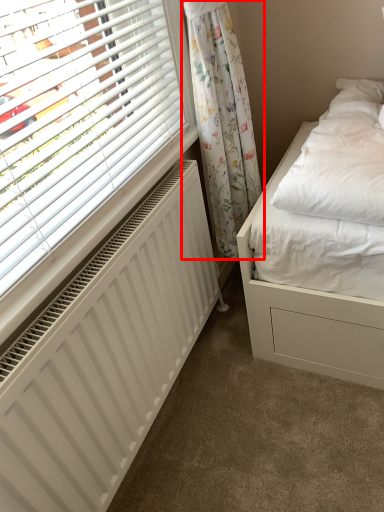
Question: Observing the image, what is the correct spatial positioning of curtain (annotated by the red box) in reference to radiator?

Choices:
 (A) right
 (B) left

Answer: (A)